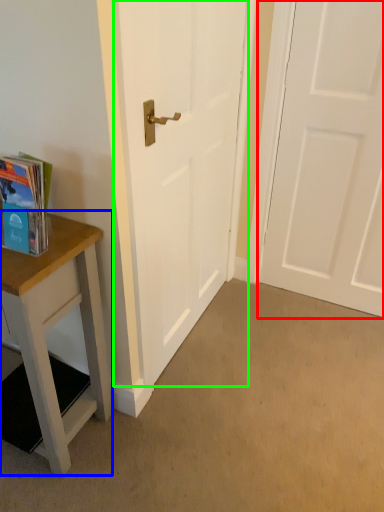
Question: Considering the real-world distances, which object is farthest from door (highlighted by a red box)? table (highlighted by a blue box) or door (highlighted by a green box)?

Choices:
 (A) table
 (B) door

Answer: (A)